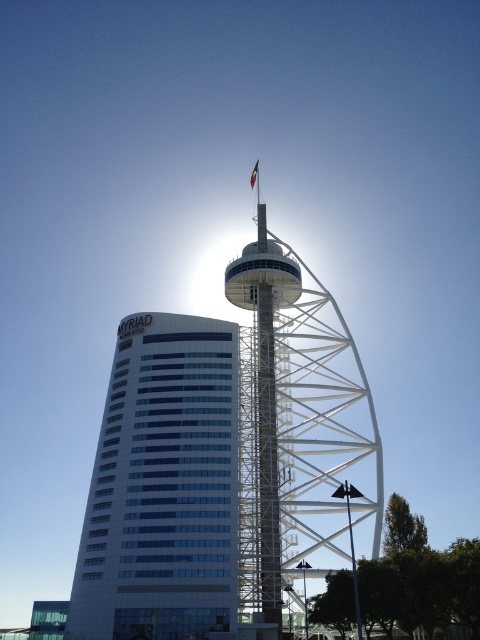
What is located at the coordinates point (163, 486)?

A white glass building at left is located at point (163, 486).

You are standing at the base of the MYRIAD building and want to take a photo of a specific point in the scene. The point you need to capture is located at coordinates point (70,611). Considering your camera can focus on objects within 80 meters, will you be able to capture this point clearly?

The distance of point (70,611) from camera is 81.23 meters, which is slightly beyond the camera focus range of 80 meters. Therefore, the point may not be captured clearly.

You are standing in front of the MYRIAD building and want to take a photo that includes both the point at coordinates point (210, 356) and the point at coordinates point (368, 451). Which point will appear closer to the camera in your photo?

Point (210, 356) is further to the camera than point (368, 451), so in the photo, point (210, 356) will appear closer to the camera than point (368, 451).